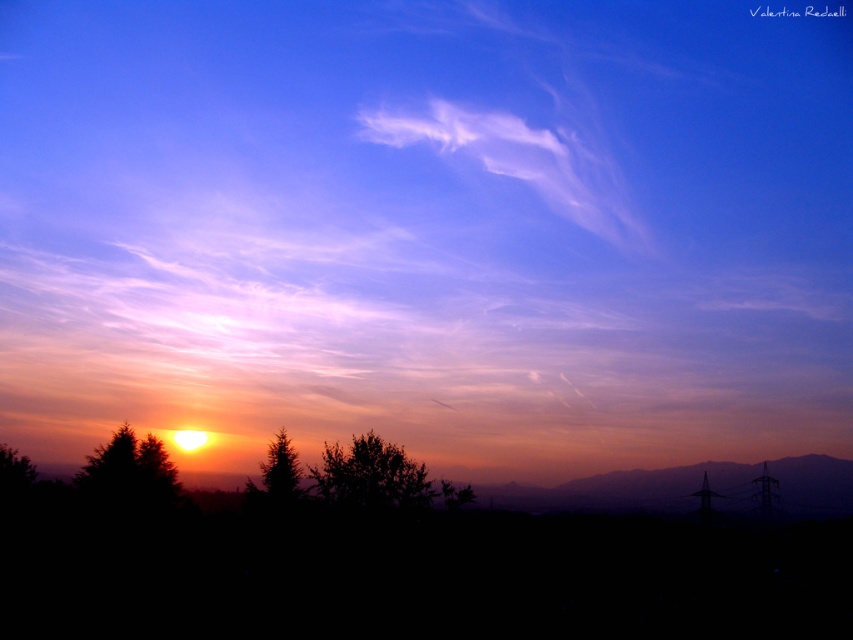
Where is `green leafy tree at center`? The height and width of the screenshot is (640, 853). green leafy tree at center is located at coordinates (370, 476).

Which is in front, point (378, 445) or point (258, 499)?

Positioned in front is point (258, 499).

What are the coordinates of `green leafy tree at center` in the screenshot? It's located at (x=370, y=476).

Between point (509, 154) and point (378, 456), which one is positioned in front?

Point (378, 456)

You are a GUI agent. You are given a task and a screenshot of the screen. Output one action in this format:
    pyautogui.click(x=<x>, y=<y>)
    Task: Click on the white fluffy cloud at upper center
    The image size is (853, 640).
    Given the screenshot: What is the action you would take?
    pyautogui.click(x=520, y=161)

Between white fluffy cloud at upper center and silvery metallic mountain at lower right, which one has less height?

Standing shorter between the two is silvery metallic mountain at lower right.

Does point (416, 120) come behind point (738, 492)?

That is True.

The width and height of the screenshot is (853, 640). I want to click on white fluffy cloud at upper center, so click(x=520, y=161).